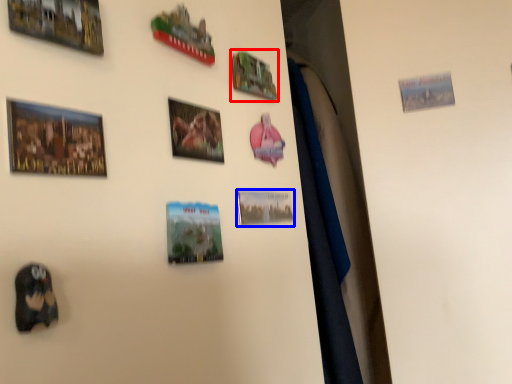
Question: Among these objects, which one is nearest to the camera, picture frame (highlighted by a red box) or picture frame (highlighted by a blue box)?

Choices:
 (A) picture frame
 (B) picture frame

Answer: (B)